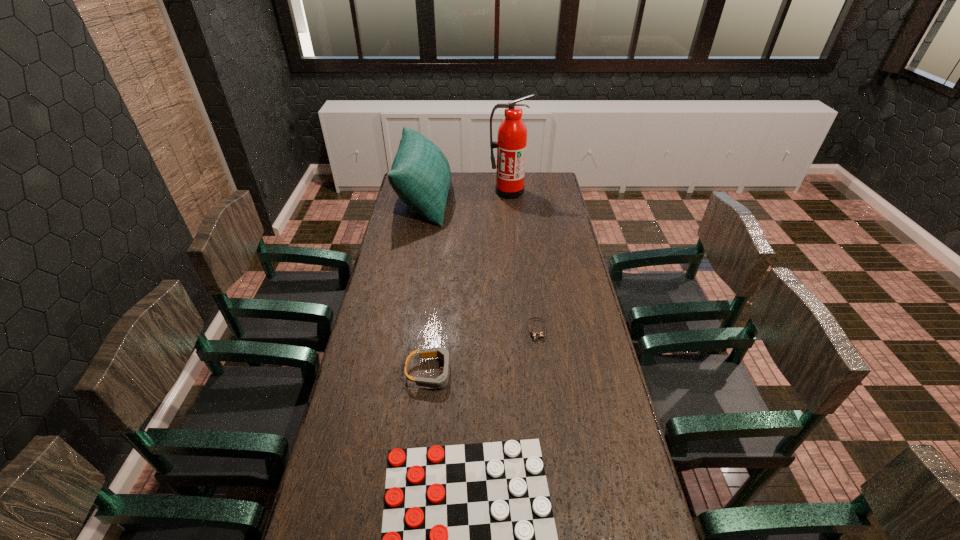
Locate an element on the screen. empty space that is in between the taller goggles and the right goggles is located at coordinates (484, 352).

Find the location of a particular element. vacant area that lies between the left goggles and the fire extinguisher is located at coordinates (469, 282).

The height and width of the screenshot is (540, 960). I want to click on free area in between the tallest object and the second nearest object, so click(x=469, y=282).

The width and height of the screenshot is (960, 540). Identify the location of object that stands as the second closest to the cushion. (534, 335).

Identify the location of object that is the second closest to the farther goggles. (468, 539).

At what (x,y) coordinates should I click in order to perform the action: click on free location that satisfies the following two spatial constraints: 1. on the label side of the fire extinguisher; 2. on the front and back of the taller goggles. Please return your answer as a coordinate pair (x, y). This screenshot has width=960, height=540. Looking at the image, I should click on (525, 373).

Locate an element on the screen. The width and height of the screenshot is (960, 540). blank area in the image that satisfies the following two spatial constraints: 1. on the label side of the fire extinguisher; 2. on the front and back of the fourth farthest object is located at coordinates (525, 373).

Locate an element on the screen. Image resolution: width=960 pixels, height=540 pixels. blank area in the image that satisfies the following two spatial constraints: 1. on the label side of the tallest object; 2. on the front and back of the nearer goggles is located at coordinates (525, 373).

What are the coordinates of `free space that satisfies the following two spatial constraints: 1. on the front lenses and sides of the shorter goggles; 2. on the front and back of the nearer goggles` in the screenshot? It's located at (542, 373).